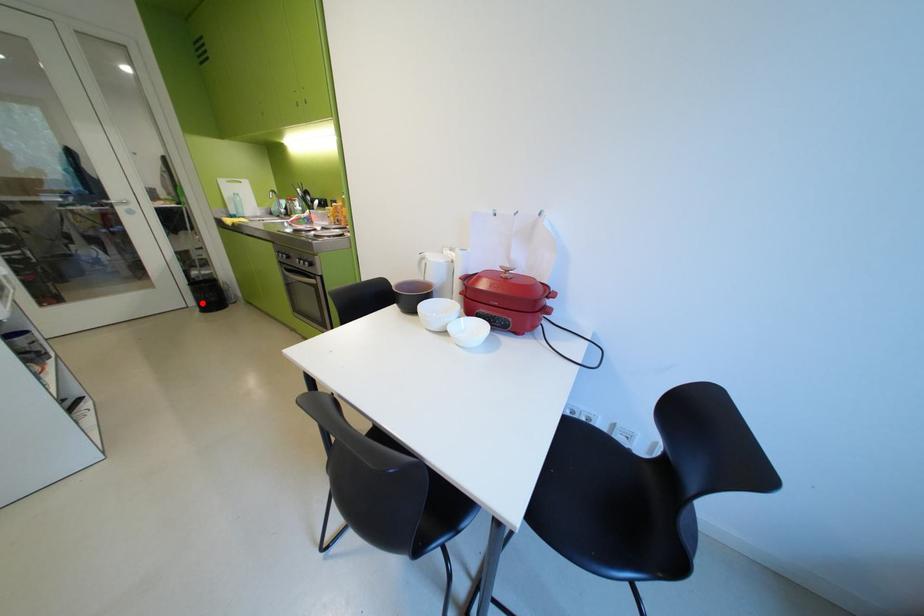
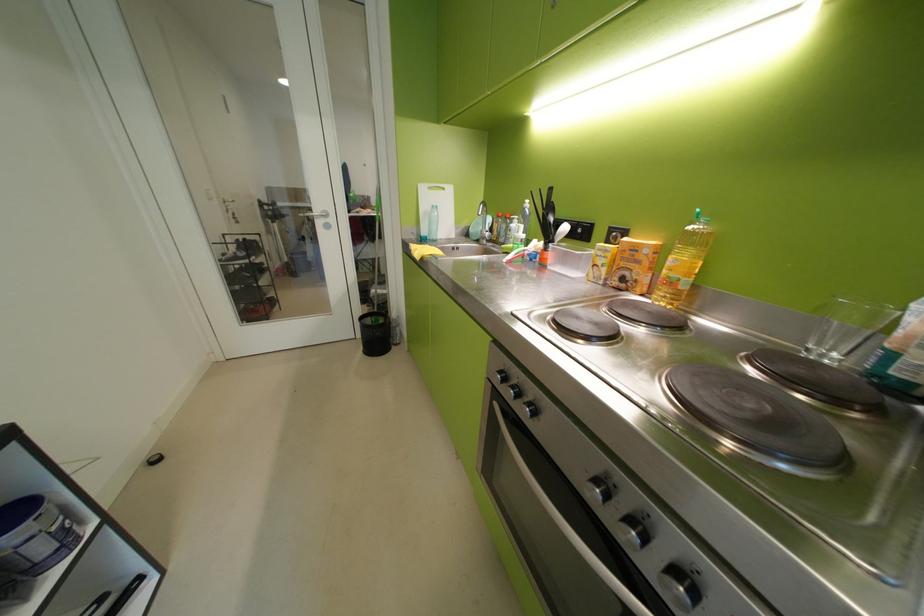
Question: I am providing you with two images of the same scene from different viewpoints. Given a red point in image1, look at the same physical point in image2. Is it:

Choices:
 (A) Closer to the viewpoint
 (B) Farther from the viewpoint

Answer: (B)